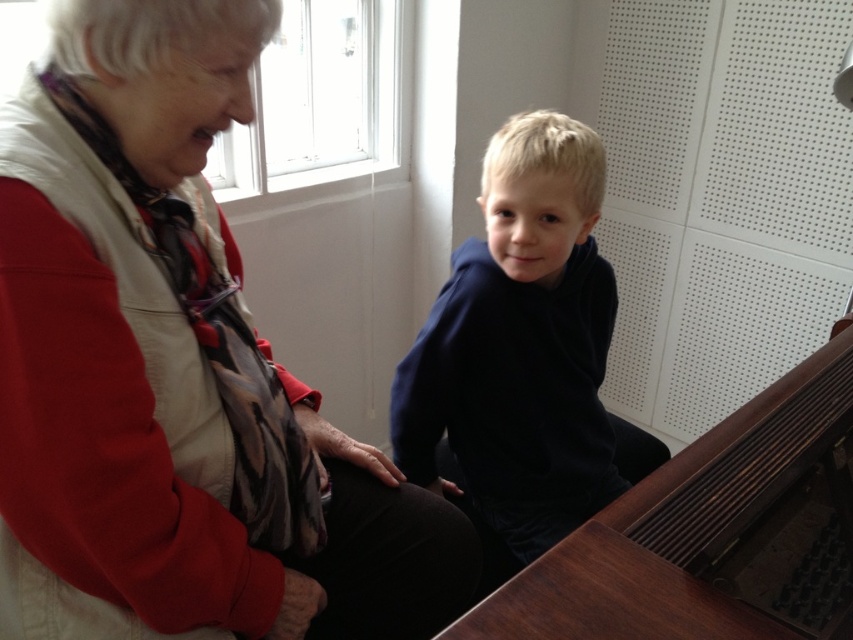
Question: Is matte red sweater at upper left above dark blue hoodie at center?

Choices:
 (A) no
 (B) yes

Answer: (A)

Question: Among these points, which one is farthest from the camera?

Choices:
 (A) (700, 588)
 (B) (607, 428)
 (C) (373, 500)

Answer: (B)

Question: In this image, where is matte red sweater at upper left located relative to brown wooden harpsichord at lower right?

Choices:
 (A) right
 (B) left

Answer: (B)

Question: Which point is closer to the camera?

Choices:
 (A) dark blue hoodie at center
 (B) matte red sweater at upper left
 (C) brown wooden harpsichord at lower right

Answer: (B)

Question: Estimate the real-world distances between objects in this image. Which object is farther from the matte red sweater at upper left?

Choices:
 (A) brown wooden harpsichord at lower right
 (B) dark blue hoodie at center

Answer: (A)

Question: Is matte red sweater at upper left positioned before dark blue hoodie at center?

Choices:
 (A) yes
 (B) no

Answer: (A)